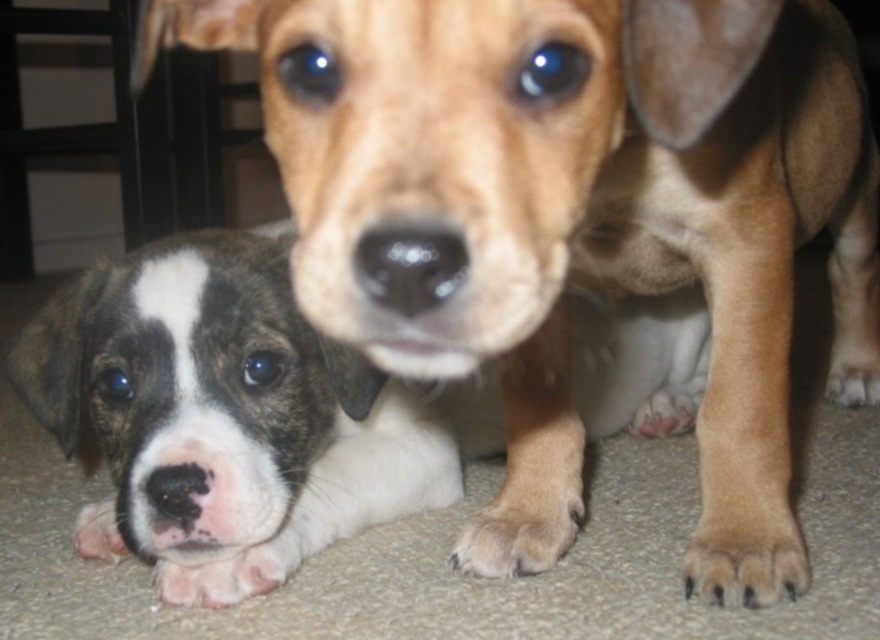
How far apart are brown/white fur puppy at lower left and brown fur paw at lower right?

brown/white fur puppy at lower left is 1.04 meters from brown fur paw at lower right.

Between brown/white fur puppy at lower left and brown fur paw at lower right, which one has more height?

With more height is brown/white fur puppy at lower left.

Which is in front, point (123, 435) or point (859, 392)?

Positioned in front is point (123, 435).

The height and width of the screenshot is (640, 880). What are the coordinates of `brown/white fur puppy at lower left` in the screenshot? It's located at (206, 408).

Does brown/white fur puppy at lower left have a greater width compared to pink soft fur paw at lower left?

Yes, brown/white fur puppy at lower left is wider than pink soft fur paw at lower left.

Which is in front, point (208, 248) or point (94, 547)?

Point (208, 248) is in front.

Identify the location of brown/white fur puppy at lower left. (206, 408).

Who is positioned more to the right, brown furry paw at lower right or brown fur paw at lower right?

From the viewer's perspective, brown fur paw at lower right appears more on the right side.

Describe the element at coordinates (745, 554) in the screenshot. The width and height of the screenshot is (880, 640). I see `brown furry paw at lower right` at that location.

Where is `brown furry paw at lower right`? This screenshot has height=640, width=880. brown furry paw at lower right is located at coordinates (745, 554).